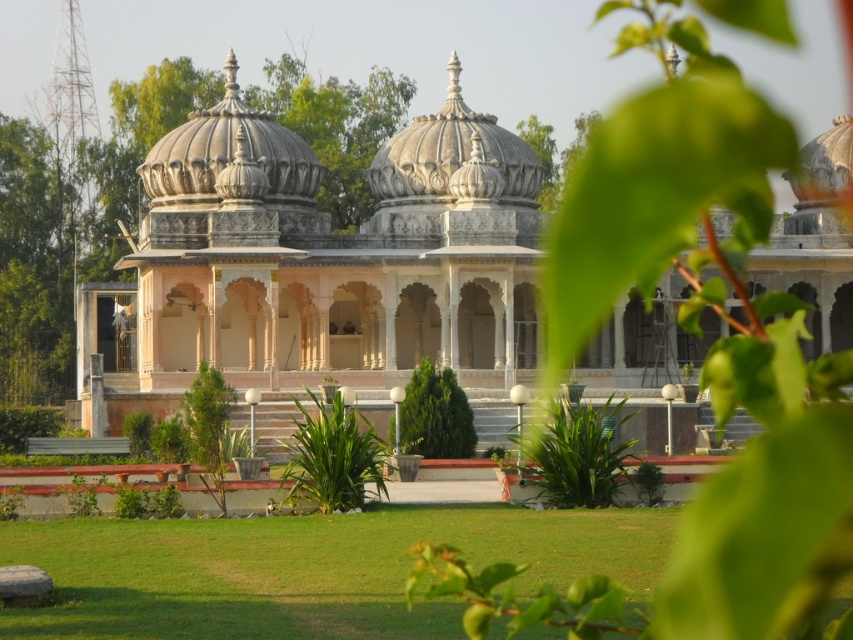
Can you confirm if white marble palace at center is taller than white stone dome at center?

Incorrect, white marble palace at center's height is not larger of white stone dome at center's.

Who is higher up, white marble palace at center or white stone dome at center?

white stone dome at center is higher up.

You are a GUI agent. You are given a task and a screenshot of the screen. Output one action in this format:
    pyautogui.click(x=<x>, y=<y>)
    Task: Click on the white marble palace at center
    Image resolution: width=853 pixels, height=640 pixels.
    Given the screenshot: What is the action you would take?
    pyautogui.click(x=316, y=268)

Find the location of a particular element. Image resolution: width=853 pixels, height=640 pixels. white marble palace at center is located at coordinates (316, 268).

Is point (3, 163) positioned in front of point (436, 376)?

No, it is not.

Is white stone dome at center to the left of green leafy tree at center from the viewer's perspective?

Indeed, white stone dome at center is positioned on the left side of green leafy tree at center.

Is point (323, 112) in front of point (426, 372)?

That is False.

Find the location of a particular element. white stone dome at center is located at coordinates (76, 218).

Can you confirm if white marble palace at center is shorter than green leafy tree at center?

No, white marble palace at center is not shorter than green leafy tree at center.

This screenshot has height=640, width=853. What are the coordinates of `white marble palace at center` in the screenshot? It's located at tap(316, 268).